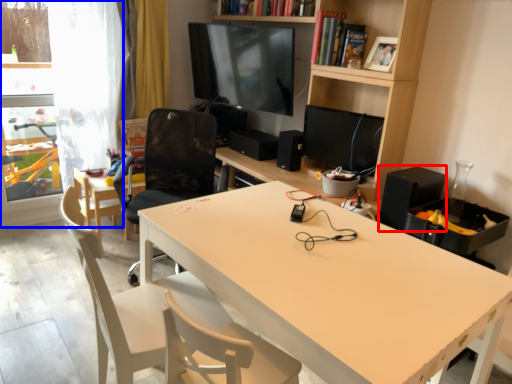
Question: Which of the following is the farthest to the observer, speaker (highlighted by a red box) or glass door (highlighted by a blue box)?

Choices:
 (A) speaker
 (B) glass door

Answer: (B)